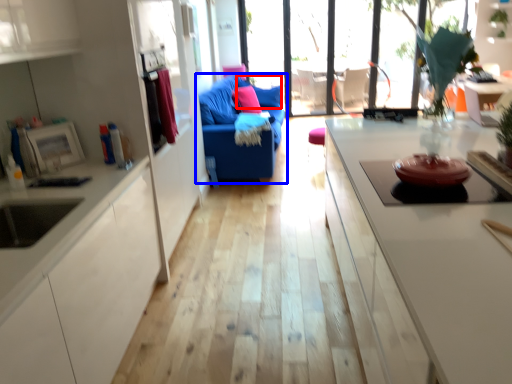
Question: Among these objects, which one is nearest to the camera, pillow (highlighted by a red box) or studio couch (highlighted by a blue box)?

Choices:
 (A) pillow
 (B) studio couch

Answer: (B)